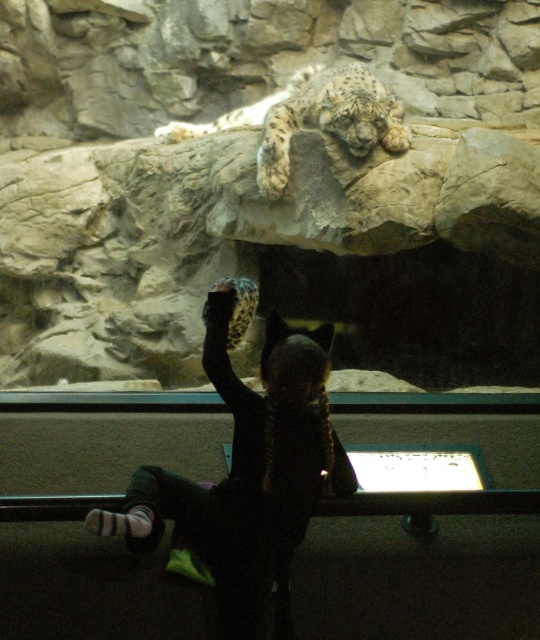
Is dark fur coat at center above white fur snow leopard at upper center?

Incorrect, dark fur coat at center is not positioned above white fur snow leopard at upper center.

Can you confirm if dark fur coat at center is shorter than white fur snow leopard at upper center?

No.

Does point (217, 573) come farther from viewer compared to point (354, 116)?

No, (217, 573) is closer to viewer.

This screenshot has width=540, height=640. I want to click on dark fur coat at center, so click(x=248, y=474).